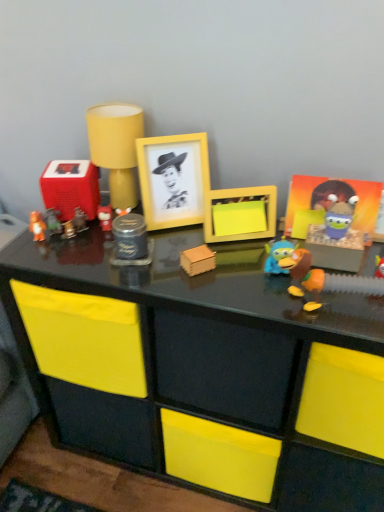
Locate an element on the screen. Image resolution: width=384 pixels, height=512 pixels. vacant area that lies to the right of metallic gold toy at center-left, marked as the 9th toy in a right-to-left arrangement is located at coordinates (141, 255).